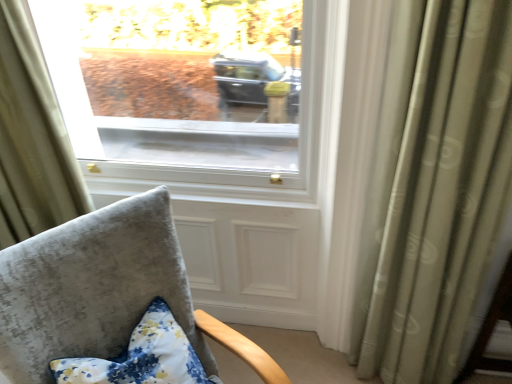
Question: Is velvet gray chair at lower left at the back of silky green curtain at right, which is the 1th curtain from right to left?

Choices:
 (A) yes
 (B) no

Answer: (B)

Question: Can you confirm if silky green curtain at right, which is the 2th curtain from left to right, is thinner than velvet gray chair at lower left?

Choices:
 (A) no
 (B) yes

Answer: (B)

Question: From the image's perspective, is silky green curtain at right, which is the 1th curtain from right to left, located beneath velvet gray chair at lower left?

Choices:
 (A) no
 (B) yes

Answer: (A)

Question: Are silky green curtain at right, which is the 1th curtain from right to left, and velvet gray chair at lower left making contact?

Choices:
 (A) yes
 (B) no

Answer: (B)

Question: Is silky green curtain at right, which is the 1th curtain from right to left, smaller than velvet gray chair at lower left?

Choices:
 (A) yes
 (B) no

Answer: (A)

Question: Is silky green curtain at right, which is the 2th curtain from left to right, surrounding velvet gray chair at lower left?

Choices:
 (A) no
 (B) yes

Answer: (A)

Question: Can you confirm if floral fabric pillow at lower left is positioned to the left of velvet gray chair at lower left?

Choices:
 (A) yes
 (B) no

Answer: (A)

Question: Is floral fabric pillow at lower left in contact with velvet gray chair at lower left?

Choices:
 (A) yes
 (B) no

Answer: (B)

Question: Does floral fabric pillow at lower left lie behind velvet gray chair at lower left?

Choices:
 (A) yes
 (B) no

Answer: (A)

Question: Does floral fabric pillow at lower left have a greater width compared to velvet gray chair at lower left?

Choices:
 (A) yes
 (B) no

Answer: (B)

Question: From a real-world perspective, is floral fabric pillow at lower left under velvet gray chair at lower left?

Choices:
 (A) yes
 (B) no

Answer: (A)

Question: Is floral fabric pillow at lower left positioned beyond the bounds of velvet gray chair at lower left?

Choices:
 (A) yes
 (B) no

Answer: (B)

Question: From a real-world perspective, is silky green curtain at right, which is the 2th curtain from left to right, located beneath floral fabric pillow at lower left?

Choices:
 (A) yes
 (B) no

Answer: (B)